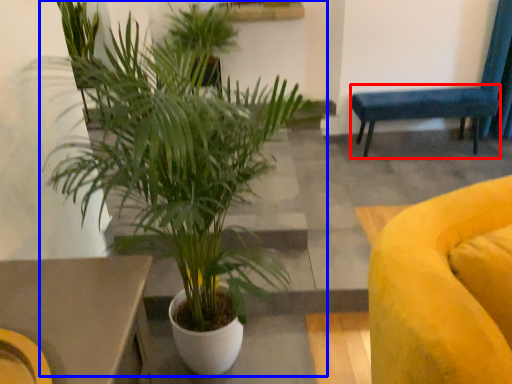
Question: Which object is further to the camera taking this photo, armchair (highlighted by a red box) or houseplant (highlighted by a blue box)?

Choices:
 (A) armchair
 (B) houseplant

Answer: (A)